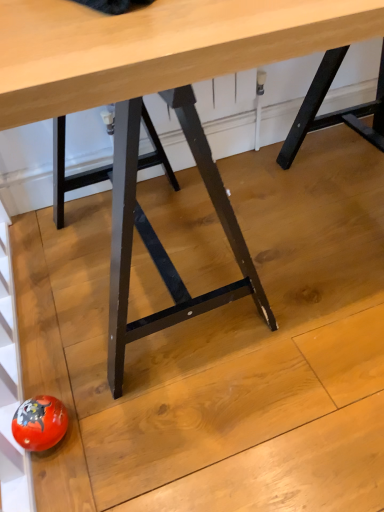
Find the location of a particular element. This screenshot has width=384, height=512. unoccupied space behind shiny red ball at lower left is located at coordinates pyautogui.click(x=60, y=355).